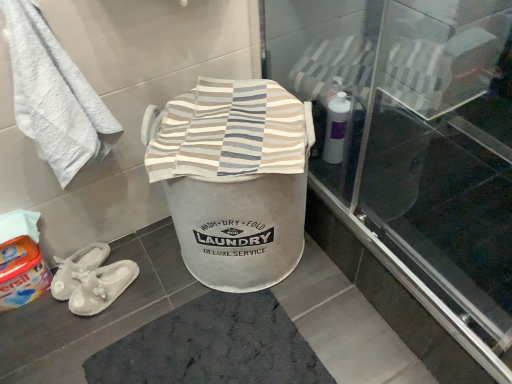
The height and width of the screenshot is (384, 512). Find the location of `spots to the right of white fabric slippers at lower left`. spots to the right of white fabric slippers at lower left is located at coordinates (157, 285).